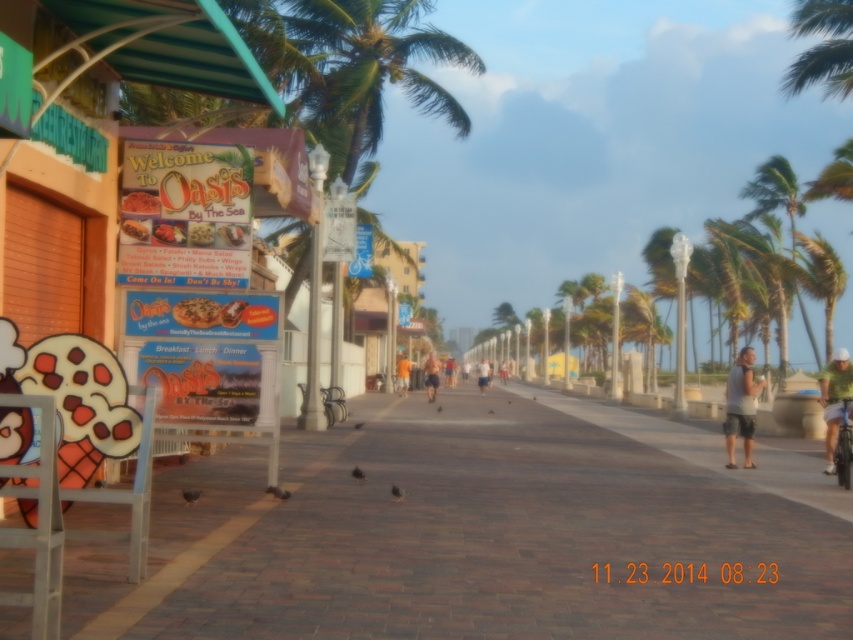
You are standing on the boardwalk and want to take a photo of the brown brick pavement at center and the light brown skin at center. Which object should you focus on first to ensure both are in clear view?

The brown brick pavement at center is closer to the viewer than the light brown skin at center, so you should focus on the brown brick pavement at center first to ensure both are in clear view.

Based on the photo, you are a photographer standing on the boardwalk and want to capture both the green leafy palm tree at right and the green fabric shirt at right in the same frame. Which object should you focus on first to ensure both are in the shot?

The green leafy palm tree at right is taller than the green fabric shirt at right, so you should focus on the taller palm tree first to ensure both are in the frame.